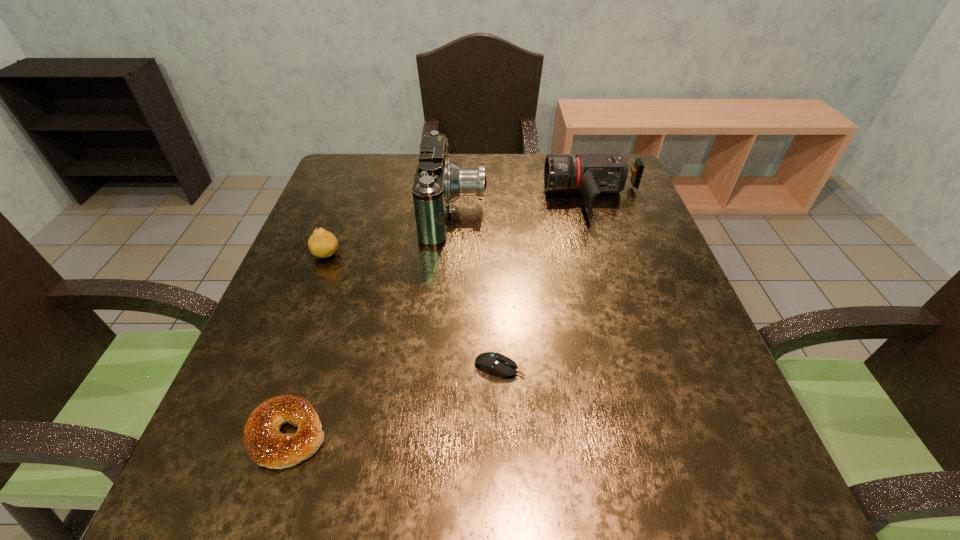
Image resolution: width=960 pixels, height=540 pixels. Find the location of `free spot located 0.280m on the lens of the shorter camcorder`. free spot located 0.280m on the lens of the shorter camcorder is located at coordinates (443, 198).

Where is `free point located 0.200m on the lens of the shorter camcorder`? Image resolution: width=960 pixels, height=540 pixels. free point located 0.200m on the lens of the shorter camcorder is located at coordinates (472, 198).

Identify the location of vacant space located 0.170m on the lens of the shorter camcorder. The width and height of the screenshot is (960, 540). (483, 198).

You are a GUI agent. You are given a task and a screenshot of the screen. Output one action in this format:
    pyautogui.click(x=<x>, y=<y>)
    Task: Click on the vacant region located on the right of the pear
    This screenshot has width=960, height=540.
    Given the screenshot: What is the action you would take?
    pyautogui.click(x=383, y=254)

This screenshot has width=960, height=540. I want to click on free location located on the right of the bagel, so click(x=564, y=434).

You are a GUI agent. You are given a task and a screenshot of the screen. Output one action in this format:
    pyautogui.click(x=<x>, y=<y>)
    Task: Click on the free region located 0.330m on the back of the shortest object
    Image resolution: width=960 pixels, height=540 pixels.
    Given the screenshot: What is the action you would take?
    pyautogui.click(x=494, y=242)

The height and width of the screenshot is (540, 960). What are the coordinates of `object situated at the near edge` in the screenshot? It's located at (265, 444).

This screenshot has height=540, width=960. In order to click on pear that is at the left edge in this screenshot , I will do `click(322, 243)`.

Where is `bagel at the left edge`? The width and height of the screenshot is (960, 540). bagel at the left edge is located at coordinates (265, 444).

Identify the location of object positioned at the right edge. The height and width of the screenshot is (540, 960). pos(590,175).